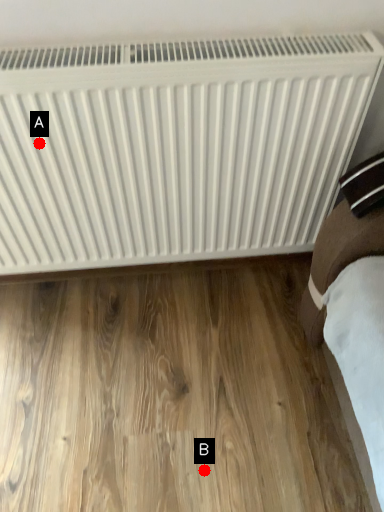
Question: Two points are circled on the image, labeled by A and B beside each circle. Which of the following is the closest to the observer?

Choices:
 (A) A is closer
 (B) B is closer

Answer: (A)